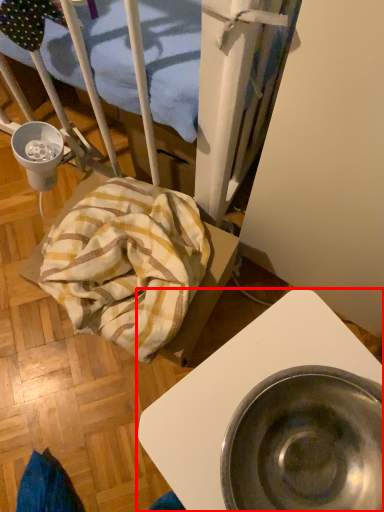
Question: In this image, where is furniture (annotated by the red box) located relative to blanket?

Choices:
 (A) right
 (B) left

Answer: (A)